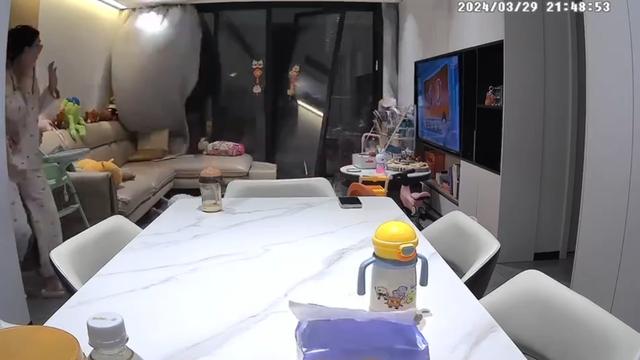
This screenshot has height=360, width=640. In order to click on curtain in this screenshot , I will do `click(156, 64)`.